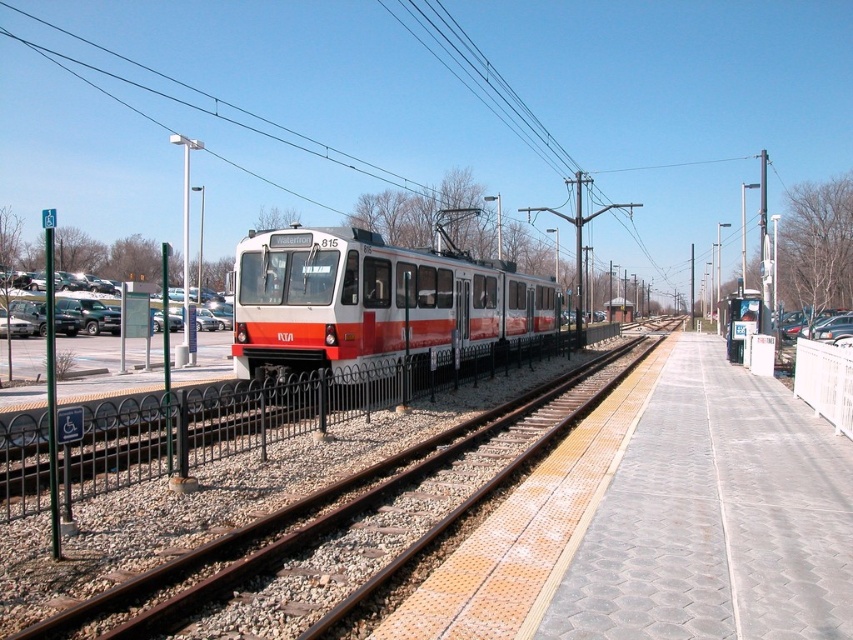
You are a maintenance worker checking the height clearance between the metal train track at center and the white glossy train at center. Which one has a greater height?

The white glossy train at center is taller than the metal train track at center, so the train has a greater height.

You are a passenger waiting at the station. You see the white glossy train at center and the metallic wire at upper center. Which object is closer to the sky?

The metallic wire at upper center is closer to the sky than the white glossy train at center.

You are a maintenance worker inspecting the light rail system. You notice the metal train track at center and the metallic wire at upper center. Which object is positioned higher from the ground?

The metallic wire at upper center is positioned higher from the ground than the metal train track at center.